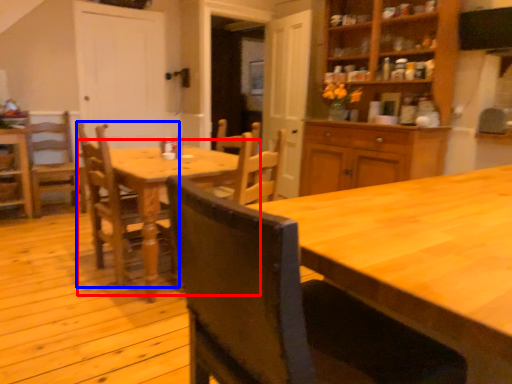
Question: Among these objects, which one is nearest to the camera, kitchen & dining room table (highlighted by a red box) or chair (highlighted by a blue box)?

Choices:
 (A) kitchen & dining room table
 (B) chair

Answer: (A)